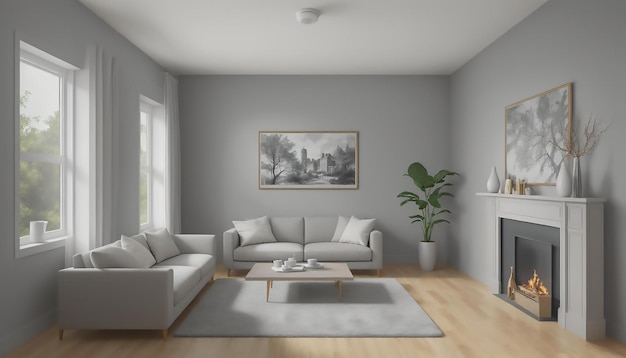
I want to click on wood floor, so click(x=295, y=348).